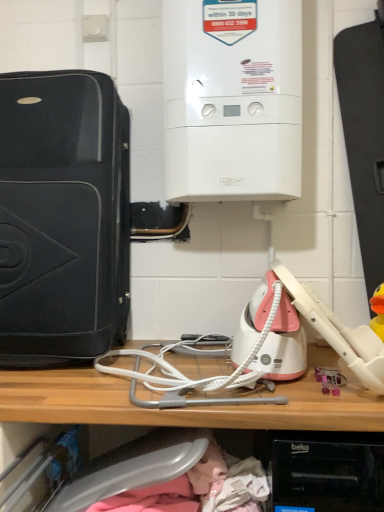
Question: Is white glossy boiler at upper center, the 2th home appliance from the left, outside white textured wire at center, positioned as the 1th wire in bottom-to-top order?

Choices:
 (A) no
 (B) yes

Answer: (B)

Question: Is white glossy boiler at upper center, the 2th home appliance from the left, thinner than white textured wire at center, positioned as the 1th wire in bottom-to-top order?

Choices:
 (A) no
 (B) yes

Answer: (B)

Question: Considering the relative positions of white glossy boiler at upper center, the 2th home appliance from the left, and white textured wire at center, positioned as the 1th wire in bottom-to-top order, in the image provided, is white glossy boiler at upper center, the 2th home appliance from the left, to the right of white textured wire at center, positioned as the 1th wire in bottom-to-top order, from the viewer's perspective?

Choices:
 (A) yes
 (B) no

Answer: (A)

Question: Could you tell me if white glossy boiler at upper center, the 2th home appliance from the left, is facing white textured wire at center, positioned as the 1th wire in bottom-to-top order?

Choices:
 (A) yes
 (B) no

Answer: (B)

Question: Is white glossy boiler at upper center, which is counted as the first home appliance, starting from the right, far away from white textured wire at center, the second wire positioned from the top?

Choices:
 (A) yes
 (B) no

Answer: (B)

Question: From the image's perspective, is wooden shelf at center above or below white glossy boiler at upper center, which is counted as the first home appliance, starting from the right?

Choices:
 (A) below
 (B) above

Answer: (A)

Question: Based on their sizes in the image, would you say wooden shelf at center is bigger or smaller than white glossy boiler at upper center, the 2th home appliance from the left?

Choices:
 (A) small
 (B) big

Answer: (B)

Question: Is wooden shelf at center in front of or behind white glossy boiler at upper center, the 2th home appliance from the left, in the image?

Choices:
 (A) behind
 (B) front

Answer: (B)

Question: Is wooden shelf at center wider or thinner than white glossy boiler at upper center, the 2th home appliance from the left?

Choices:
 (A) wide
 (B) thin

Answer: (A)

Question: Is wooden shelf at center taller or shorter than pink plastic toy at lower right?

Choices:
 (A) tall
 (B) short

Answer: (A)

Question: From a real-world perspective, is wooden shelf at center physically located above or below pink plastic toy at lower right?

Choices:
 (A) below
 (B) above

Answer: (A)

Question: Based on their positions, is wooden shelf at center located to the left or right of pink plastic toy at lower right?

Choices:
 (A) left
 (B) right

Answer: (A)

Question: Looking at their shapes, would you say wooden shelf at center is wider or thinner than pink plastic toy at lower right?

Choices:
 (A) wide
 (B) thin

Answer: (A)

Question: In the image, is matte black suitcase at left, positioned as the 1th home appliance in left-to-right order, positioned in front of or behind white textured wire at center, the second wire positioned from the top?

Choices:
 (A) behind
 (B) front

Answer: (A)

Question: Looking at their shapes, would you say matte black suitcase at left, positioned as the 1th home appliance in left-to-right order, is wider or thinner than white textured wire at center, the second wire positioned from the top?

Choices:
 (A) thin
 (B) wide

Answer: (A)